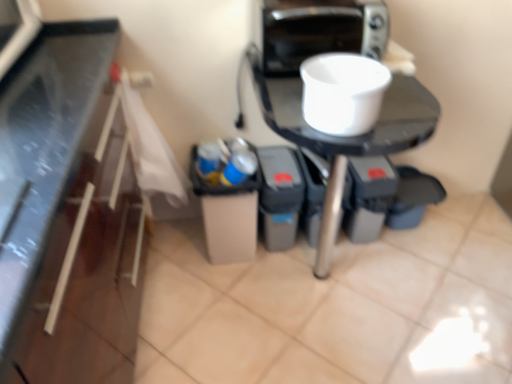
I want to click on space that is in front of white glossy table at center, so click(335, 355).